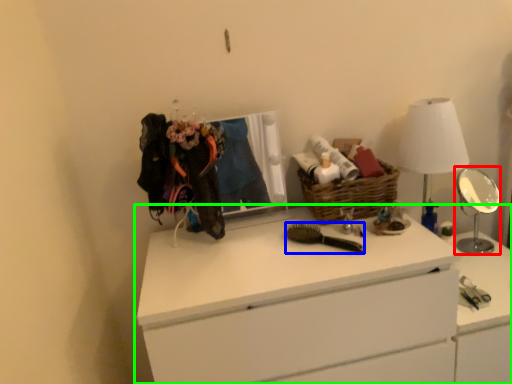
Question: Which object is positioned farthest from mirror (highlighted by a red box)? Select from brush (highlighted by a blue box) and chest of drawers (highlighted by a green box).

Choices:
 (A) brush
 (B) chest of drawers

Answer: (A)